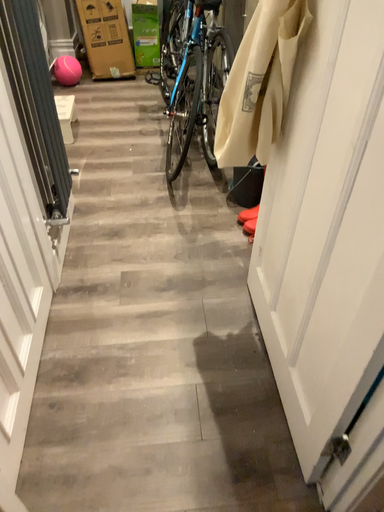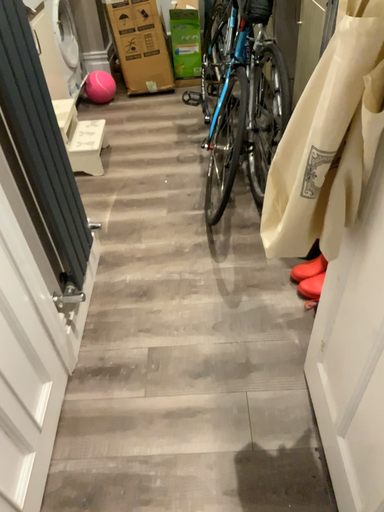
Question: How did the camera likely rotate when shooting the video?

Choices:
 (A) rotated right
 (B) rotated left

Answer: (B)